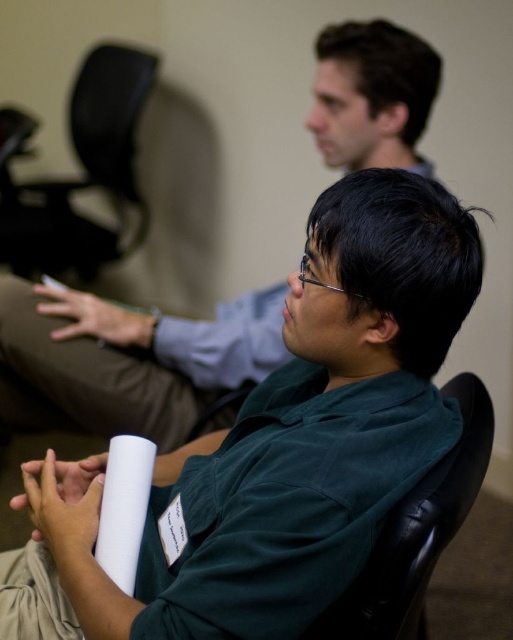
Between black leather swivel chair at left and black leather chair at center, which one appears on the left side from the viewer's perspective?

black leather swivel chair at left

Does point (18, 253) come behind point (424, 524)?

Yes, it is.

Locate an element on the screen. black leather swivel chair at left is located at coordinates (84, 176).

Is green fabric shirt at center shorter than green matte shirt at center?

No.

Can you confirm if green fabric shirt at center is smaller than green matte shirt at center?

Actually, green fabric shirt at center might be larger than green matte shirt at center.

Is point (448, 275) more distant than point (401, 106)?

No, (448, 275) is in front of (401, 106).

Identify the location of green fabric shirt at center. (279, 444).

At what (x,y) coordinates should I click in order to perform the action: click on green fabric shirt at center. Please return your answer as a coordinate pair (x, y). This screenshot has width=513, height=640. Looking at the image, I should click on (279, 444).

Which of these two, green fabric shirt at center or black leather swivel chair at left, stands shorter?

green fabric shirt at center is shorter.

Is point (232, 547) behind point (128, 52)?

No, it is in front of (128, 52).

This screenshot has height=640, width=513. I want to click on green fabric shirt at center, so click(279, 444).